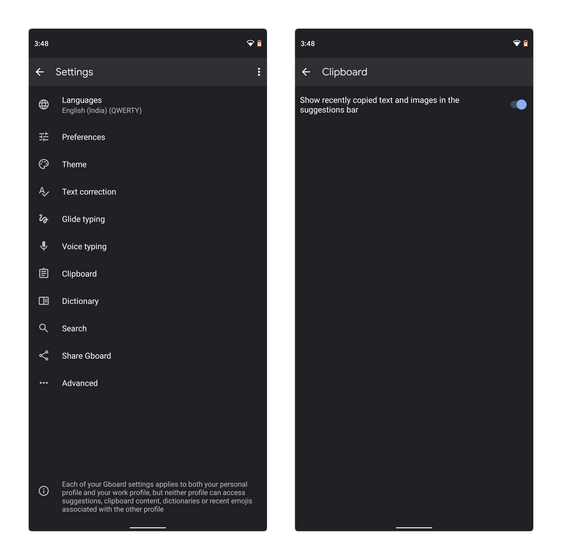
This screenshot has height=560, width=562. What are the coordinates of `clipboard` in the screenshot? It's located at (352, 70), (83, 278).